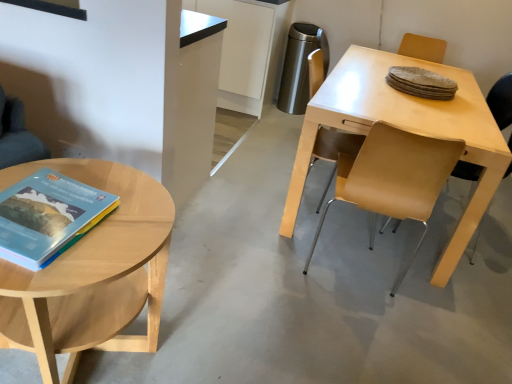
This screenshot has width=512, height=384. Find the location of `vacant space to the right of light brown wood coffee table at left`. vacant space to the right of light brown wood coffee table at left is located at coordinates (240, 334).